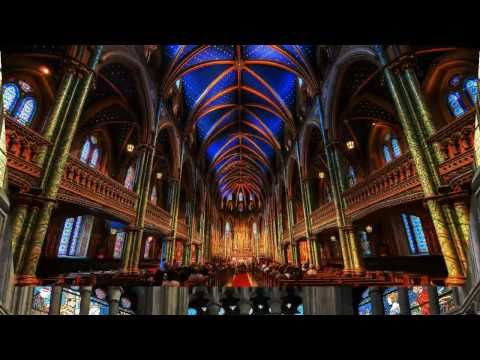
Identify the location of red carpet. This screenshot has width=480, height=360. (240, 275).